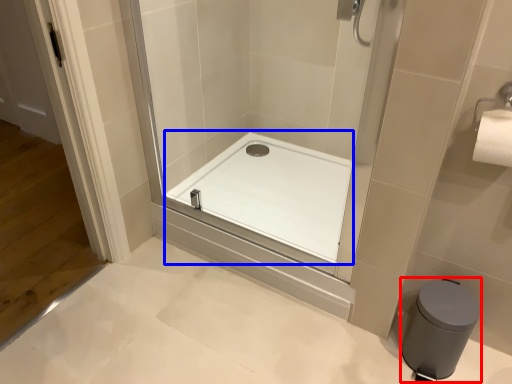
Question: Which object is closer to the camera taking this photo, bidet (highlighted by a red box) or bath (highlighted by a blue box)?

Choices:
 (A) bidet
 (B) bath

Answer: (A)